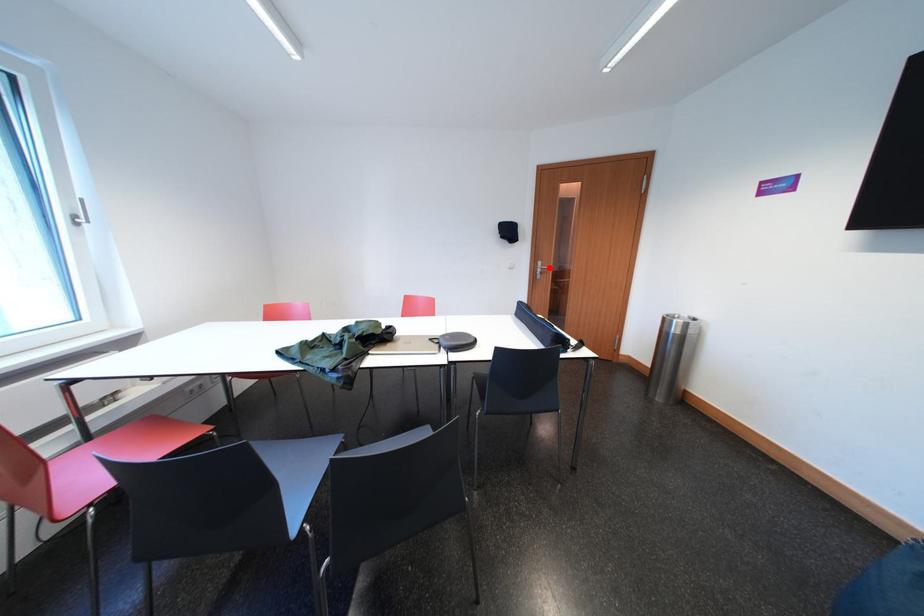
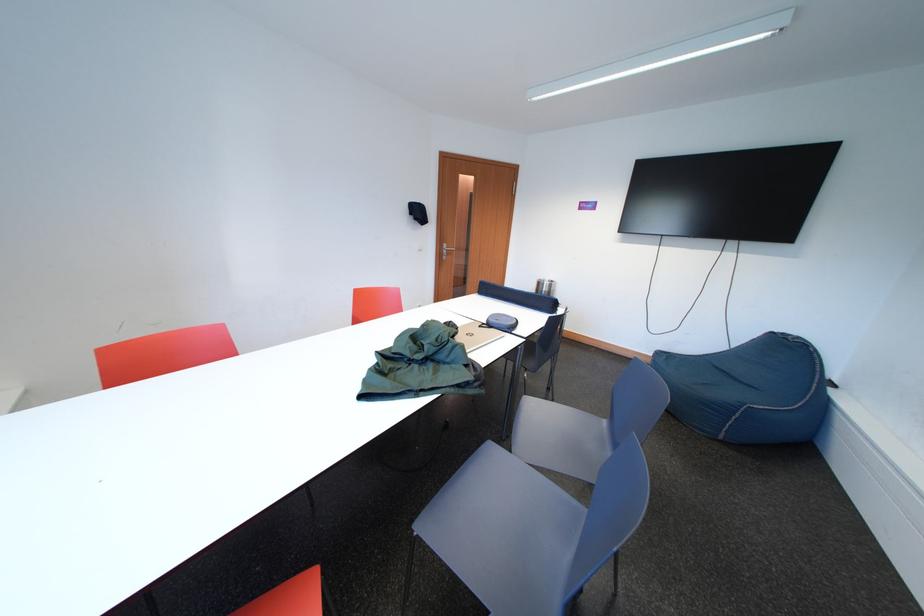
Where in the second image is the point corresponding to the highlighted location from the first image?

(455, 249)